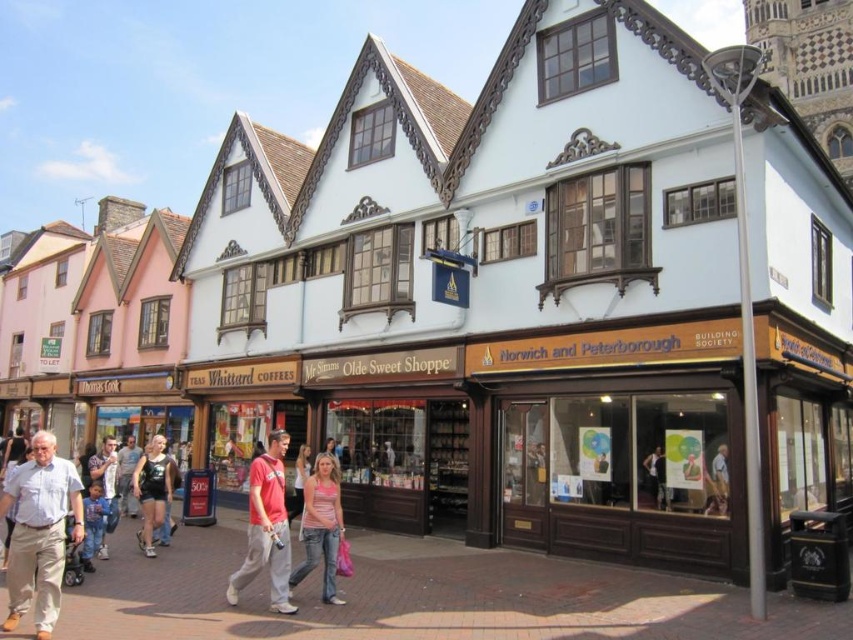
Based on the photo, is light blue cotton shirt at lower left closer to camera compared to matte black shorts at center?

That is True.

Is light blue cotton shirt at lower left to the left of matte black shorts at center from the viewer's perspective?

Incorrect, light blue cotton shirt at lower left is not on the left side of matte black shorts at center.

Is point (50, 464) more distant than point (155, 492)?

No, (50, 464) is in front of (155, 492).

Find the location of a particular element. The height and width of the screenshot is (640, 853). light blue cotton shirt at lower left is located at coordinates (39, 532).

Which is more to the right, denim jeans at lower left or blue denim jeans at lower left?

From the viewer's perspective, blue denim jeans at lower left appears more on the right side.

In the scene shown: Who is shorter, denim jeans at lower left or blue denim jeans at lower left?

blue denim jeans at lower left is shorter.

Does point (103, 541) come in front of point (94, 509)?

No, (103, 541) is behind (94, 509).

You are a GUI agent. You are given a task and a screenshot of the screen. Output one action in this format:
    pyautogui.click(x=<x>, y=<y>)
    Task: Click on the denim jeans at lower left
    The image size is (853, 640).
    Given the screenshot: What is the action you would take?
    pyautogui.click(x=106, y=486)

Measure the distance between denim jeans at lower left and camera.

A distance of 131.00 feet exists between denim jeans at lower left and camera.

Consider the image. Between denim jeans at lower left and dark blue jeans at center, which one is positioned lower?

denim jeans at lower left is lower down.

You are a GUI agent. You are given a task and a screenshot of the screen. Output one action in this format:
    pyautogui.click(x=<x>, y=<y>)
    Task: Click on the denim jeans at lower left
    This screenshot has height=640, width=853.
    Given the screenshot: What is the action you would take?
    pyautogui.click(x=106, y=486)

The width and height of the screenshot is (853, 640). What are the coordinates of `denim jeans at lower left` in the screenshot? It's located at (106, 486).